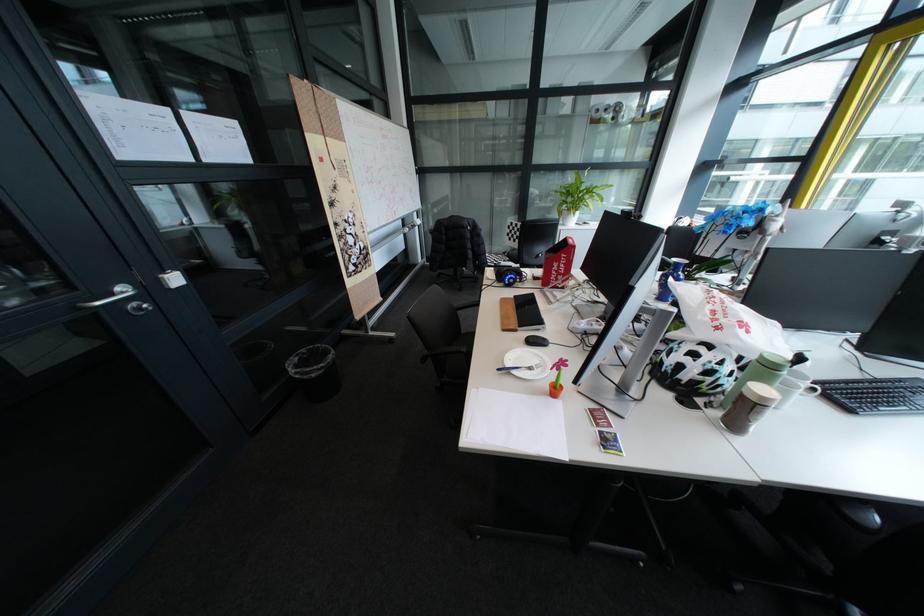
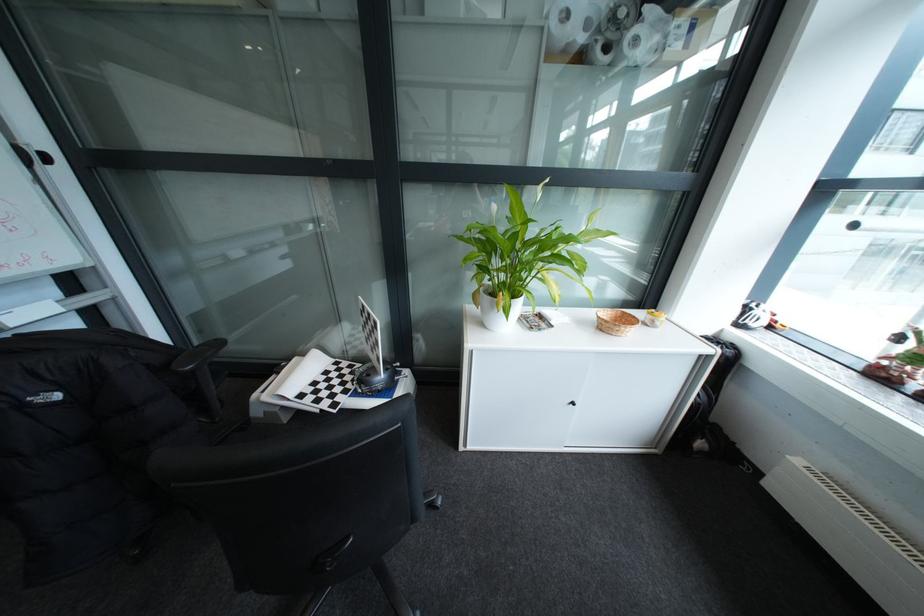
The point at (589, 209) is marked in the first image. Where is the corresponding point in the second image?

(521, 299)